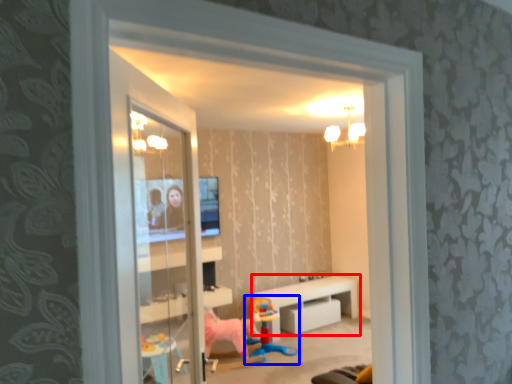
Question: Which of the following is the farthest to the observer, table (highlighted by a red box) or toy (highlighted by a blue box)?

Choices:
 (A) table
 (B) toy

Answer: (A)